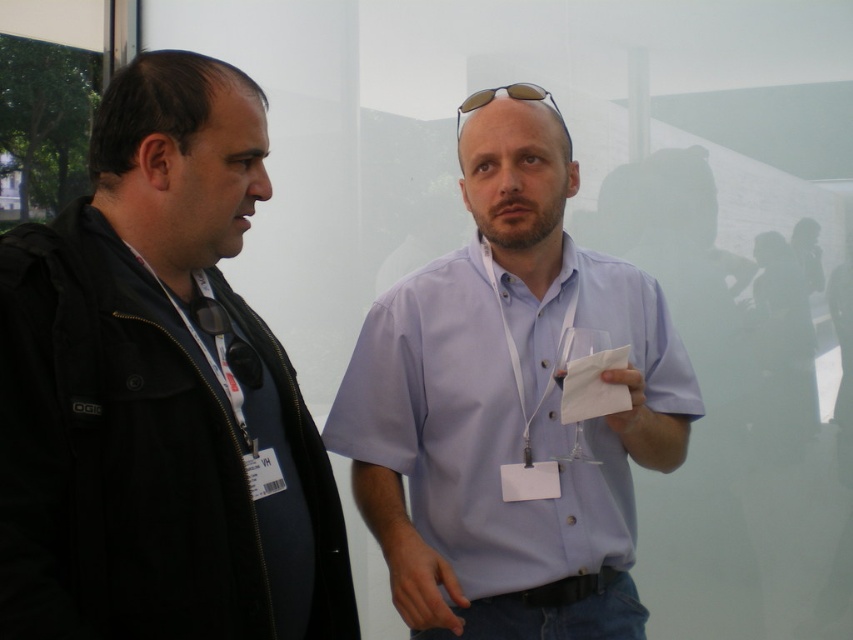
Question: Among these points, which one is farthest from the camera?

Choices:
 (A) (569, 145)
 (B) (576, 188)

Answer: (B)

Question: From the image, what is the correct spatial relationship of black matte jacket at left in relation to sunglasses at center?

Choices:
 (A) left
 (B) right

Answer: (A)

Question: Is black matte jacket at left to the right of light blue shirt at center from the viewer's perspective?

Choices:
 (A) yes
 (B) no

Answer: (B)

Question: Considering the real-world distances, which object is closest to the black matte jacket at left?

Choices:
 (A) light blue shirt at center
 (B) sunglasses at center

Answer: (A)

Question: Considering the real-world distances, which object is farthest from the light blue shirt at center?

Choices:
 (A) black matte jacket at left
 (B) sunglasses at center

Answer: (B)

Question: Can you confirm if black matte jacket at left is wider than sunglasses at center?

Choices:
 (A) no
 (B) yes

Answer: (B)